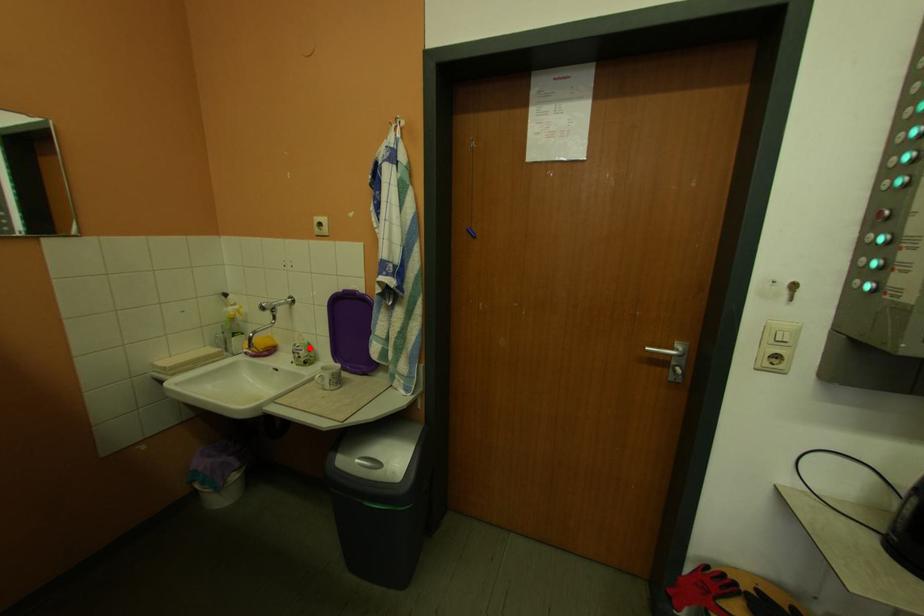
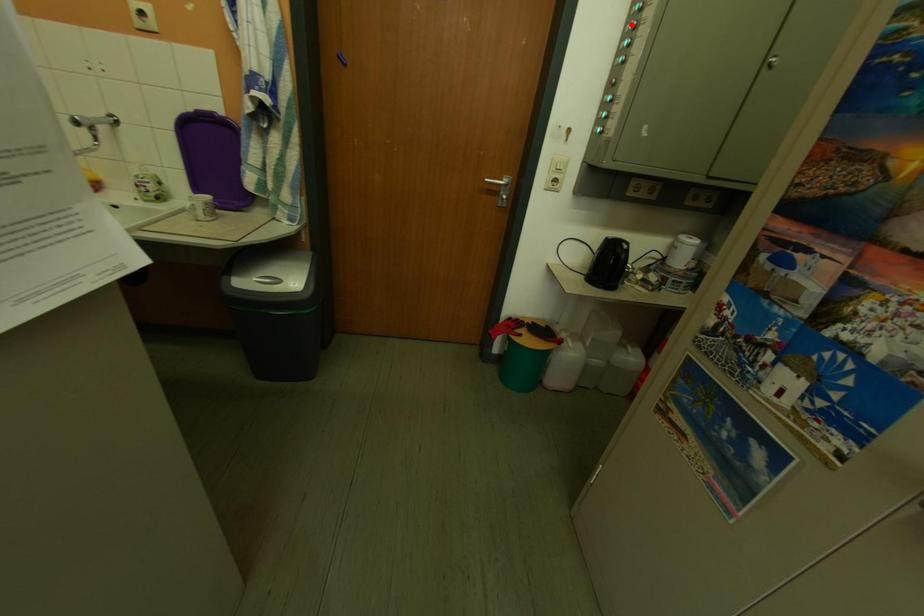
I am providing you with two images of the same scene from different viewpoints. A red point is marked on the first image and another point is marked on the second image. Do the highlighted points in image1 and image2 indicate the same real-world spot?

No